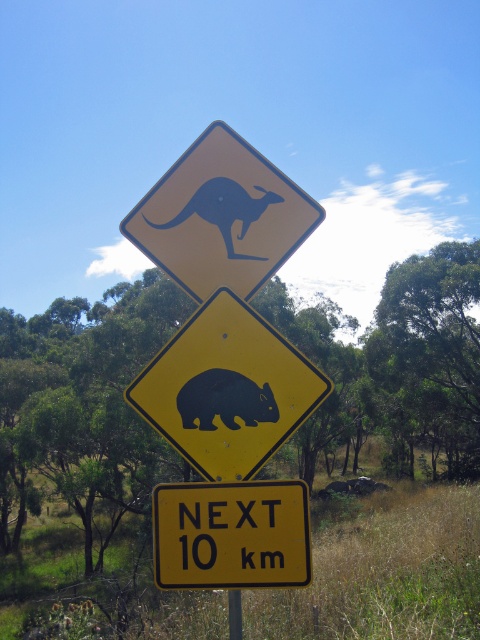
Question: Is yellow matte/black textured wombat at center below yellow matte kangaroo at upper center?

Choices:
 (A) yes
 (B) no

Answer: (A)

Question: Among these points, which one is nearest to the camera?

Choices:
 (A) (283, 422)
 (B) (217, 216)
 (C) (181, 504)
 (D) (237, 637)

Answer: (C)

Question: Can you confirm if yellow/yellowish paper at center is smaller than yellow plastic pole at center?

Choices:
 (A) no
 (B) yes

Answer: (A)

Question: Which of the following is the closest to the observer?

Choices:
 (A) (164, 428)
 (B) (297, 241)

Answer: (A)

Question: Among these objects, which one is nearest to the camera?

Choices:
 (A) yellow plastic pole at center
 (B) black matte kangaroo at upper center
 (C) yellow matte kangaroo at upper center
 (D) yellow/yellowish paper at center

Answer: (D)

Question: Is yellow matte kangaroo at upper center in front of yellow plastic pole at center?

Choices:
 (A) no
 (B) yes

Answer: (A)